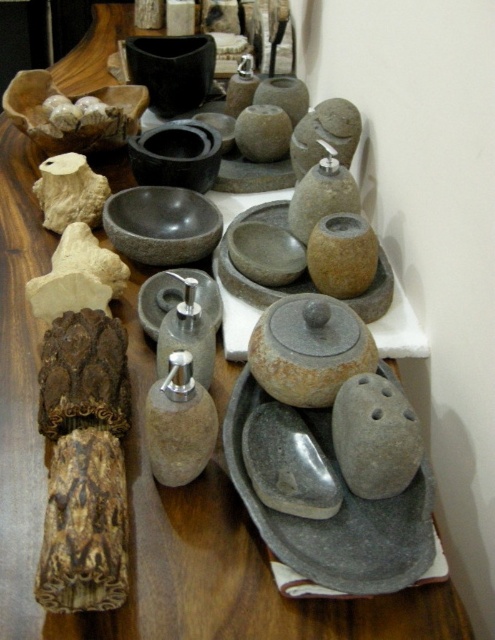
Question: Which point appears farthest from the camera in this image?

Choices:
 (A) (174, 67)
 (B) (412, 413)

Answer: (A)

Question: Does gray matte stone at center-right have a greater width compared to white matte rock at upper left?

Choices:
 (A) yes
 (B) no

Answer: (B)

Question: Can you confirm if gray matte stone at center-right is thinner than gray polished stone at center?

Choices:
 (A) no
 (B) yes

Answer: (B)

Question: Which point appears farthest from the camera in this image?

Choices:
 (A) (385, 442)
 (B) (178, 65)

Answer: (B)

Question: Does gray polished stone at center appear on the left side of white matte rock at upper left?

Choices:
 (A) no
 (B) yes

Answer: (A)

Question: Estimate the real-world distances between objects in this image. Which object is farther from the white matte rock at upper left?

Choices:
 (A) gray matte stone at center-right
 (B) gray polished stone at center

Answer: (A)